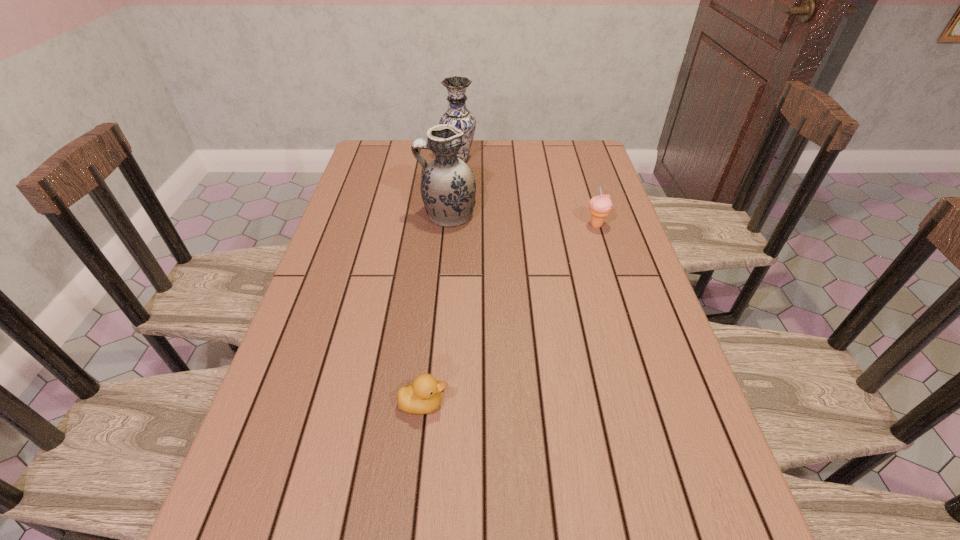
This screenshot has height=540, width=960. Identify the location of free space that is in between the duckling and the farthest object. (441, 281).

Find the location of `blank region between the farther vase and the third tallest object`. blank region between the farther vase and the third tallest object is located at coordinates (528, 193).

I want to click on free space between the rightmost object and the duckling, so click(x=510, y=315).

Find the location of a particular element. This screenshot has height=540, width=960. free space between the nearer vase and the shortest object is located at coordinates pos(435,309).

Locate which object is the closest to the farthest object. Please provide its 2D coordinates. Your answer should be formatted as a tuple, i.e. [(x, y)], where the tuple contains the x and y coordinates of a point satisfying the conditions above.

[(448, 187)]

Locate an element on the screen. object that is the third closest to the farther vase is located at coordinates (423, 396).

Locate an element on the screen. The image size is (960, 540). vacant space that satisfies the following two spatial constraints: 1. with the handle on the side of the nearer vase; 2. on the back side of the farthest object is located at coordinates (452, 159).

The image size is (960, 540). Identify the location of vacant space that satisfies the following two spatial constraints: 1. with the handle on the side of the nearer vase; 2. on the left side of the farther vase. (452, 159).

Locate an element on the screen. free location that satisfies the following two spatial constraints: 1. on the front side of the farther vase; 2. on the face of the nearest object is located at coordinates (443, 403).

You are a GUI agent. You are given a task and a screenshot of the screen. Output one action in this format:
    pyautogui.click(x=<x>, y=<y>)
    Task: Click on the vacant space that satisfies the following two spatial constraints: 1. with the handle on the side of the nearer vase; 2. on the left side of the farther vase
    Image resolution: width=960 pixels, height=540 pixels.
    Given the screenshot: What is the action you would take?
    pyautogui.click(x=452, y=159)